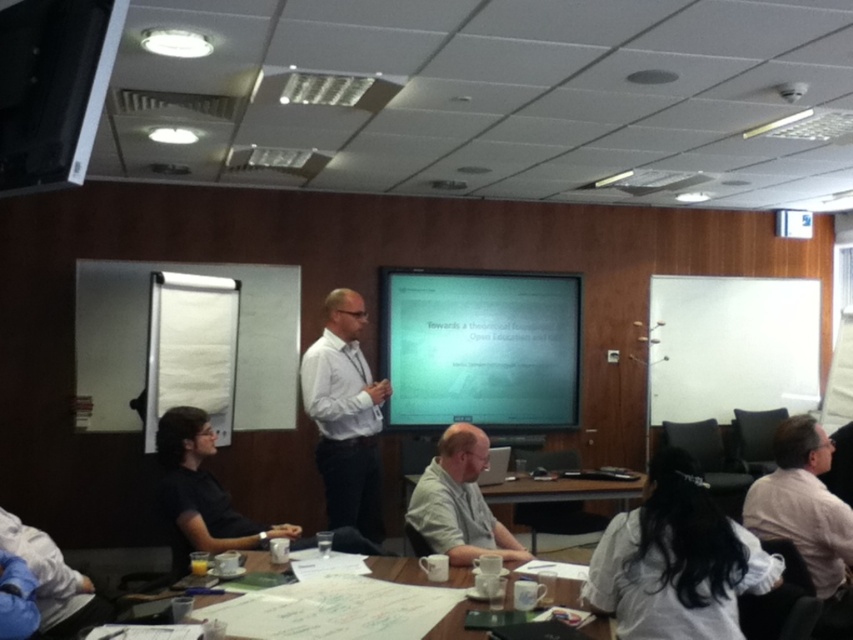
Question: Does white shirt at right have a smaller size compared to light beige shirt at center?

Choices:
 (A) no
 (B) yes

Answer: (A)

Question: Can you confirm if white matte shirt at lower right is positioned to the left of white shirt at right?

Choices:
 (A) yes
 (B) no

Answer: (A)

Question: Among these points, which one is nearest to the camera?

Choices:
 (A) (511, 540)
 (B) (602, 534)

Answer: (B)

Question: Which object appears closest to the camera in this image?

Choices:
 (A) wooden table at center
 (B) white paper at center

Answer: (B)

Question: Which of these objects is positioned farthest from the wooden table at center?

Choices:
 (A) light beige shirt at center
 (B) white matte shirt at lower right
 (C) white paper at center
 (D) white shirt at center

Answer: (B)

Question: Does matte white projector screen at center appear on the left side of white paper at center?

Choices:
 (A) no
 (B) yes

Answer: (A)